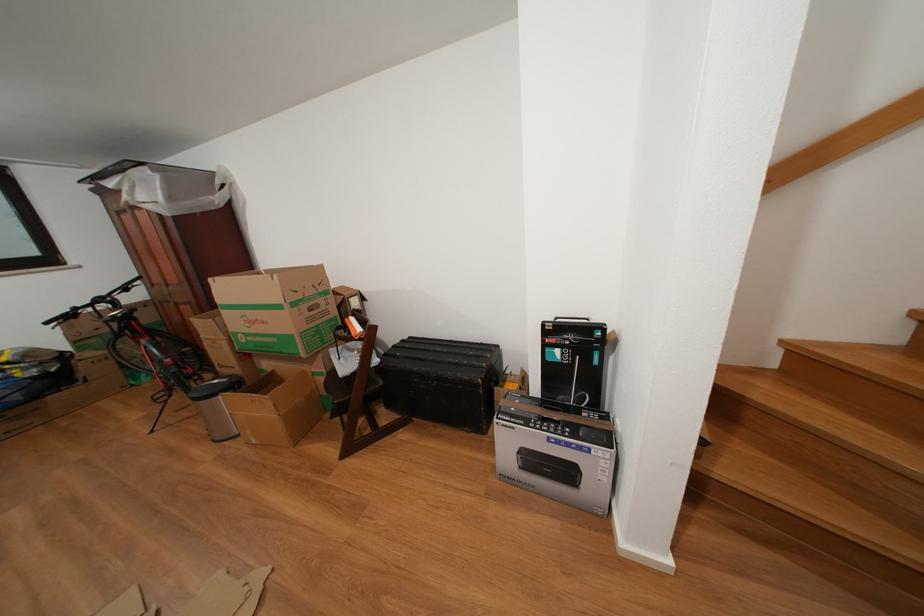
Image resolution: width=924 pixels, height=616 pixels. What are the coordinates of `bicycle seat` in the screenshot? It's located at (152, 337).